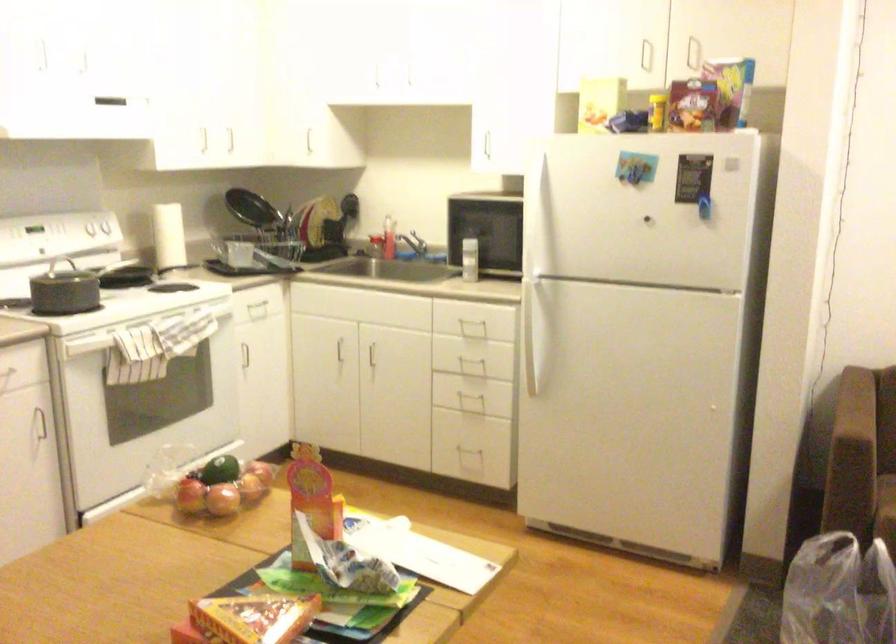
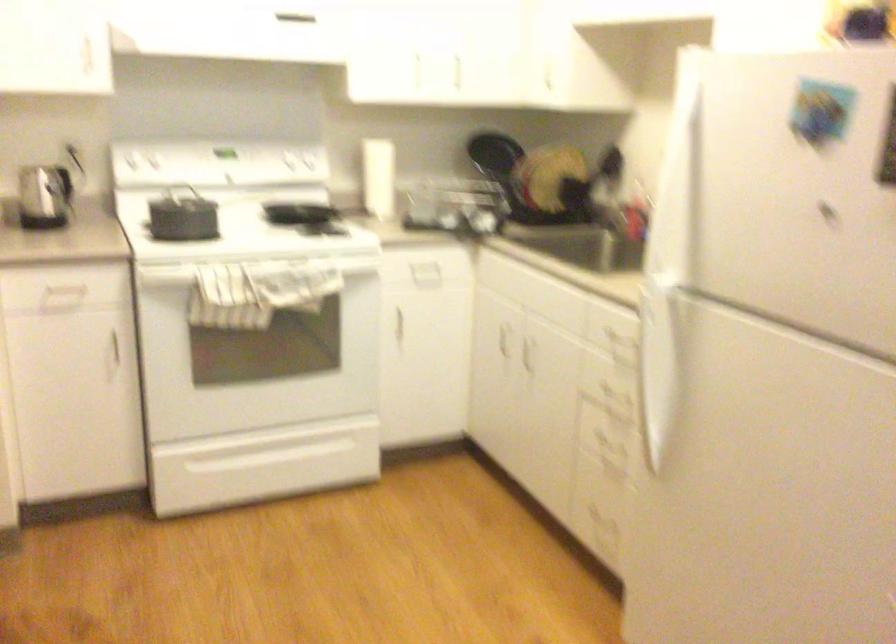
Where in the second image is the point corresponding to pixel 190 238 from the first image?

(377, 178)